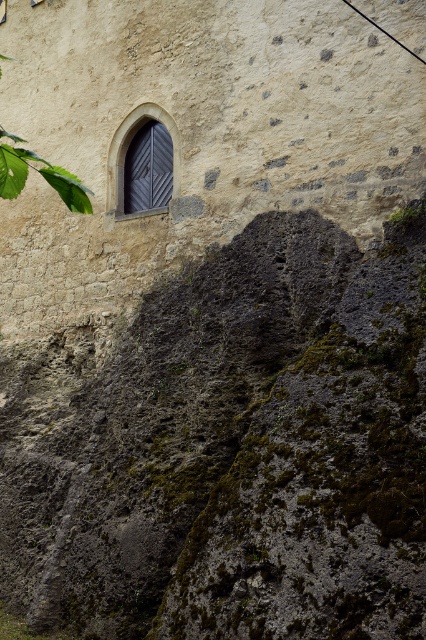
Can you confirm if green leafy tree at upper left is positioned below dark gray wood door at upper left?

Indeed, green leafy tree at upper left is positioned under dark gray wood door at upper left.

Which is more to the left, green leafy tree at upper left or dark gray wood door at upper left?

Positioned to the left is green leafy tree at upper left.

Image resolution: width=426 pixels, height=640 pixels. What do you see at coordinates (43, 176) in the screenshot?
I see `green leafy tree at upper left` at bounding box center [43, 176].

Where is `green leafy tree at upper left`? Image resolution: width=426 pixels, height=640 pixels. green leafy tree at upper left is located at coordinates (43, 176).

Is point (52, 413) farther from camera compared to point (63, 182)?

Yes, it is.

Between green mossy rock at lower left and green leafy tree at upper left, which one has less height?

green leafy tree at upper left is shorter.

Does point (351, 403) come closer to viewer compared to point (14, 182)?

No, it is behind (14, 182).

Identify the location of green mossy rock at lower left. This screenshot has height=640, width=426. (230, 449).

Is green mossy rock at lower left taller than dark gray wood door at upper left?

Yes.

Who is lower down, green mossy rock at lower left or dark gray wood door at upper left?

green mossy rock at lower left is below.

Is point (273, 230) farther from camera compared to point (108, 186)?

No, it is not.

Where is `green mossy rock at lower left`? The height and width of the screenshot is (640, 426). green mossy rock at lower left is located at coordinates (230, 449).